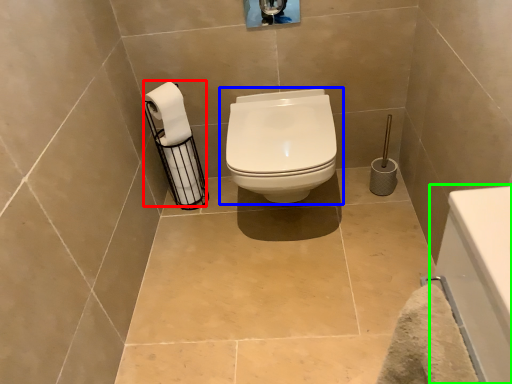
Question: Which is nearer to the toilet paper (highlighted by a red box)? toilet (highlighted by a blue box) or bath (highlighted by a green box).

Choices:
 (A) toilet
 (B) bath

Answer: (A)